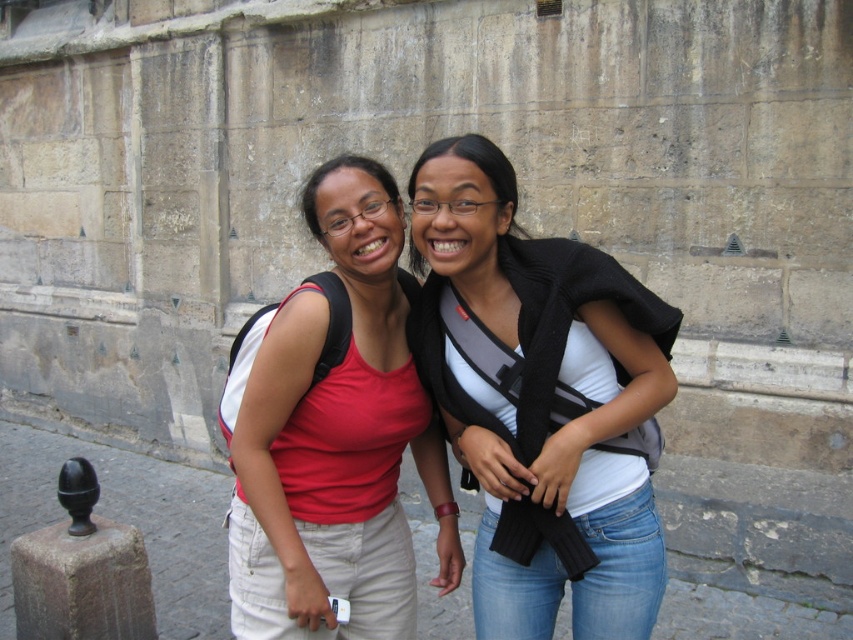
Based on the photo, you are a photographer trying to capture a clear shot of the matte red tank top at center and the dark brown stone post at lower left. Which object is closer to the camera?

The matte red tank top at center is closer to the camera because it is in front of the dark brown stone post at lower left.

You are taking a photo of two people standing near a stone wall. The first person is at point (416, 326) and the second person is at point (346, 438). To ensure both are in focus, you need to adjust the camera so that the first person is not in front of the second. Is the first person already positioned behind the second person?

Yes, the first person at point (416, 326) is already positioned behind the second person at point (346, 438), so adjusting the camera to keep them both in focus without one blocking the other is possible.

You are a photographer trying to capture a photo of the matte red tank top at center and the dark brown stone post at lower left. Which object is positioned higher in the image?

The matte red tank top at center is above the dark brown stone post at lower left, so the matte red tank top at center is positioned higher in the image.